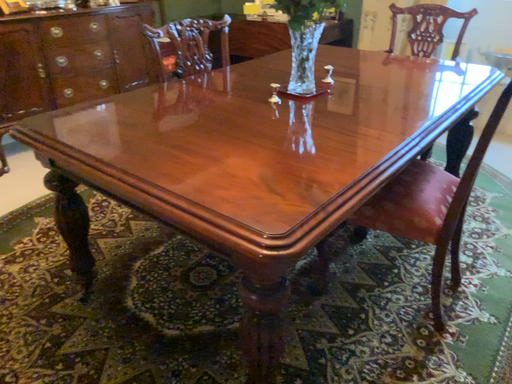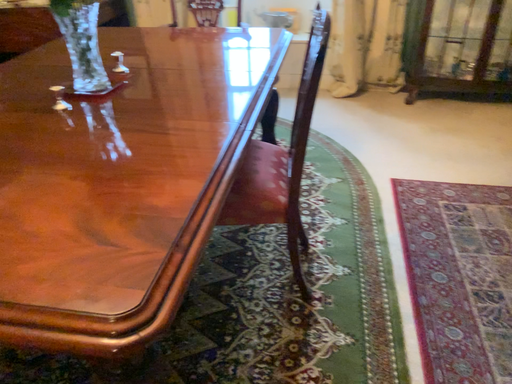
Question: How did the camera likely rotate when shooting the video?

Choices:
 (A) rotated right
 (B) rotated left

Answer: (A)